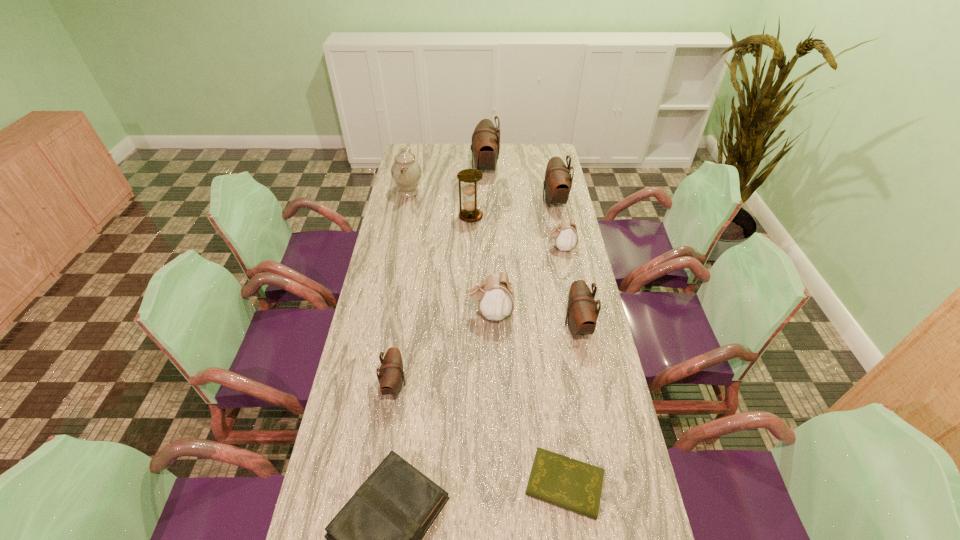
Locate an element on the screen. The height and width of the screenshot is (540, 960). vacant space located 0.080m with the flap open on the third nearest brown pouch is located at coordinates (524, 201).

Where is `free space located with the flap open on the third nearest brown pouch`? free space located with the flap open on the third nearest brown pouch is located at coordinates (508, 201).

This screenshot has height=540, width=960. Find the location of `free space located 0.270m with the flap open on the third nearest brown pouch`. free space located 0.270m with the flap open on the third nearest brown pouch is located at coordinates (482, 201).

Image resolution: width=960 pixels, height=540 pixels. I want to click on free spot located 0.100m on the front-facing side of the bigger white pouch, so click(438, 313).

Locate an element on the screen. This screenshot has width=960, height=540. free space located 0.350m on the front-facing side of the bigger white pouch is located at coordinates (x=366, y=313).

At what (x,y) coordinates should I click in order to perform the action: click on vacant space located on the front-facing side of the bigger white pouch. Please return your answer as a coordinate pair (x, y). The width and height of the screenshot is (960, 540). Looking at the image, I should click on (446, 313).

The height and width of the screenshot is (540, 960). I want to click on vacant space located 0.160m with the flap open on the second smallest brown pouch, so click(x=516, y=325).

Where is `vacant space located with the flap open on the second smallest brown pouch`? The width and height of the screenshot is (960, 540). vacant space located with the flap open on the second smallest brown pouch is located at coordinates (514, 325).

Identify the location of vacant space situated with the flap open on the second smallest brown pouch. (466, 325).

Identify the location of free space located 0.100m on the front-facing side of the farther white pouch. (520, 247).